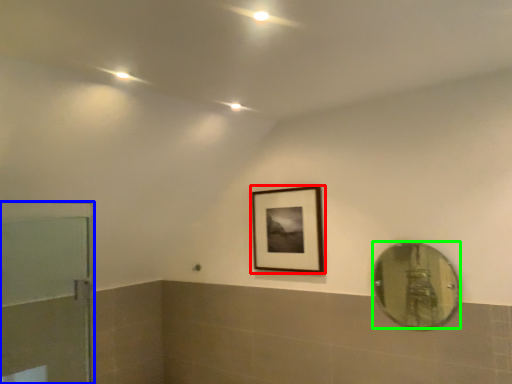
Question: Considering the real-world distances, which object is closest to picture frame (highlighted by a red box)? door (highlighted by a blue box) or mirror (highlighted by a green box).

Choices:
 (A) door
 (B) mirror

Answer: (A)